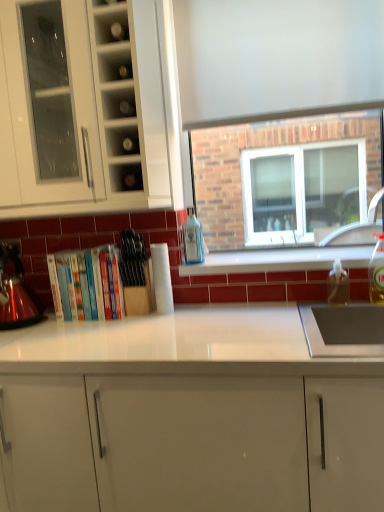
Question: Considering their positions, is matte glass shelf at upper center, placed as the 2th shelf when sorted from top to bottom, located in front of or behind white glossy cabinet at center, arranged as the first cabinetry when ordered from the bottom?

Choices:
 (A) behind
 (B) front

Answer: (A)

Question: Looking at the image, does matte glass shelf at upper center, the 1th shelf when ordered from bottom to top, seem bigger or smaller compared to white glossy cabinet at center, arranged as the first cabinetry when ordered from the bottom?

Choices:
 (A) small
 (B) big

Answer: (A)

Question: Estimate the real-world distances between objects in this image. Which object is closer to the white glossy cabinet at center, arranged as the first cabinetry when ordered from the bottom?

Choices:
 (A) white glossy cabinet at upper left, which is the first cabinetry from top to bottom
 (B) clear glass shelf at upper center, which ranks as the first shelf in top-to-bottom order
 (C) translucent plastic bottle at right, the second bottle when ordered from front to back
 (D) white paper towel at center
 (E) blue glass bottle at center, which is the 3th bottle in front-to-back order

Answer: (D)

Question: Estimate the real-world distances between objects in this image. Which object is closer to the clear glass shelf at upper center, which ranks as the first shelf in top-to-bottom order?

Choices:
 (A) white paper towel at center
 (B) matte glass shelf at upper center, placed as the 2th shelf when sorted from top to bottom
 (C) white glossy cabinet at upper left, the 2th cabinetry positioned from the bottom
 (D) clear plastic bottle at right, the third bottle in the left-to-right sequence
 (E) translucent plastic bottle at right, which is counted as the 2th bottle, starting from the right

Answer: (B)